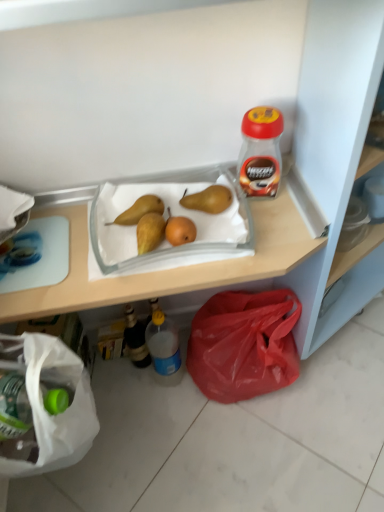
Question: From the image's perspective, would you say translucent plastic bottle at lower center, the 2th bottle positioned from the right, is positioned over yellow matte pear at center, arranged as the first pear when viewed from the left?

Choices:
 (A) no
 (B) yes

Answer: (A)

Question: Considering the relative sizes of translucent plastic bottle at lower center, which ranks as the 1th bottle in bottom-to-top order, and yellow matte pear at center, which ranks as the second pear in right-to-left order, in the image provided, is translucent plastic bottle at lower center, which ranks as the 1th bottle in bottom-to-top order, bigger than yellow matte pear at center, which ranks as the second pear in right-to-left order,?

Choices:
 (A) no
 (B) yes

Answer: (B)

Question: Is translucent plastic bottle at lower center, which ranks as the 1th bottle in bottom-to-top order, thinner than yellow matte pear at center, arranged as the first pear when viewed from the left?

Choices:
 (A) no
 (B) yes

Answer: (B)

Question: Is translucent plastic bottle at lower center, which ranks as the 1th bottle in bottom-to-top order, oriented away from yellow matte pear at center, which ranks as the second pear in right-to-left order?

Choices:
 (A) yes
 (B) no

Answer: (B)

Question: Is translucent plastic bottle at lower center, the 2th bottle positioned from the right, not inside yellow matte pear at center, which ranks as the second pear in right-to-left order?

Choices:
 (A) yes
 (B) no

Answer: (A)

Question: From a real-world perspective, is translucent plastic bottle at lower center, which is counted as the second bottle, starting from the left, located higher than yellow matte pear at center, arranged as the first pear when viewed from the left?

Choices:
 (A) no
 (B) yes

Answer: (A)

Question: Does translucent plastic bottle at lower center, marked as the third bottle in a top-to-bottom arrangement, have a greater width compared to brown matte pear at center, positioned as the 1th pear in right-to-left order?

Choices:
 (A) no
 (B) yes

Answer: (A)

Question: Is translucent plastic bottle at lower center, marked as the third bottle in a top-to-bottom arrangement, outside brown matte pear at center, arranged as the second pear when viewed from the left?

Choices:
 (A) yes
 (B) no

Answer: (A)

Question: Is translucent plastic bottle at lower center, marked as the third bottle in a top-to-bottom arrangement, far from brown matte pear at center, positioned as the 1th pear in right-to-left order?

Choices:
 (A) yes
 (B) no

Answer: (B)

Question: Considering the relative sizes of translucent plastic bottle at lower center, marked as the third bottle in a top-to-bottom arrangement, and brown matte pear at center, positioned as the 1th pear in right-to-left order, in the image provided, is translucent plastic bottle at lower center, marked as the third bottle in a top-to-bottom arrangement, thinner than brown matte pear at center, positioned as the 1th pear in right-to-left order,?

Choices:
 (A) no
 (B) yes

Answer: (B)

Question: From the image's perspective, is translucent plastic bottle at lower center, which is counted as the second bottle, starting from the left, above brown matte pear at center, positioned as the 1th pear in right-to-left order?

Choices:
 (A) yes
 (B) no

Answer: (B)

Question: From a real-world perspective, is translucent plastic bottle at lower center, the 2th bottle positioned from the right, located beneath brown matte pear at center, arranged as the second pear when viewed from the left?

Choices:
 (A) no
 (B) yes

Answer: (B)

Question: Can you confirm if red plastic jar at upper right, arranged as the 3th bottle when viewed from the left, is taller than translucent plastic bottle at lower center, which is counted as the second bottle, starting from the left?

Choices:
 (A) yes
 (B) no

Answer: (B)